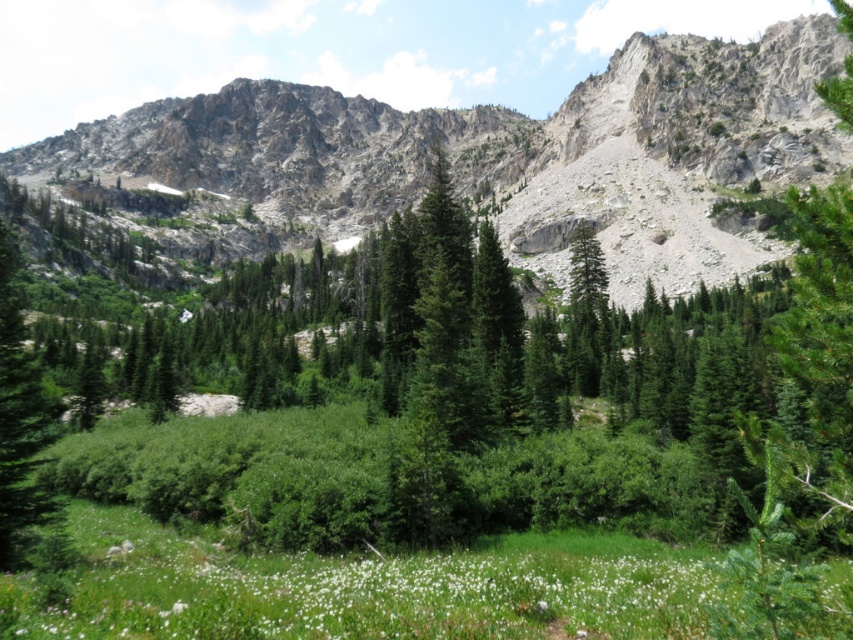
In the scene shown: Can you confirm if rocky gray mountain at upper center is positioned to the left of white fluffy flower at lower center?

Correct, you'll find rocky gray mountain at upper center to the left of white fluffy flower at lower center.

This screenshot has height=640, width=853. I want to click on rocky gray mountain at upper center, so click(509, 150).